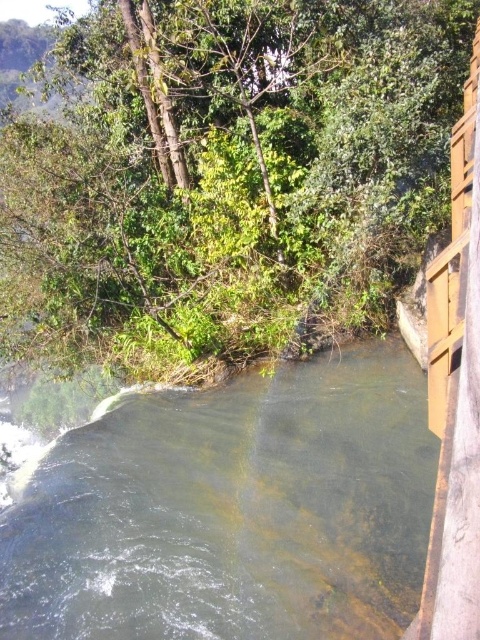
You are standing at the edge of the stream and want to cross to the other side. The green leafy tree at upper left is blocking your view. Can you see the clear water at center from your current position?

The clear water at center is behind the green leafy tree at upper left, so you cannot see it from your current position because the tree is blocking the view.

Looking at this image, you are standing at the edge of the river and notice the green leafy tree at upper left and the clear water at center. Which object is positioned more to the left side of the image?

The green leafy tree at upper left is positioned more to the left side of the image than the clear water at center.